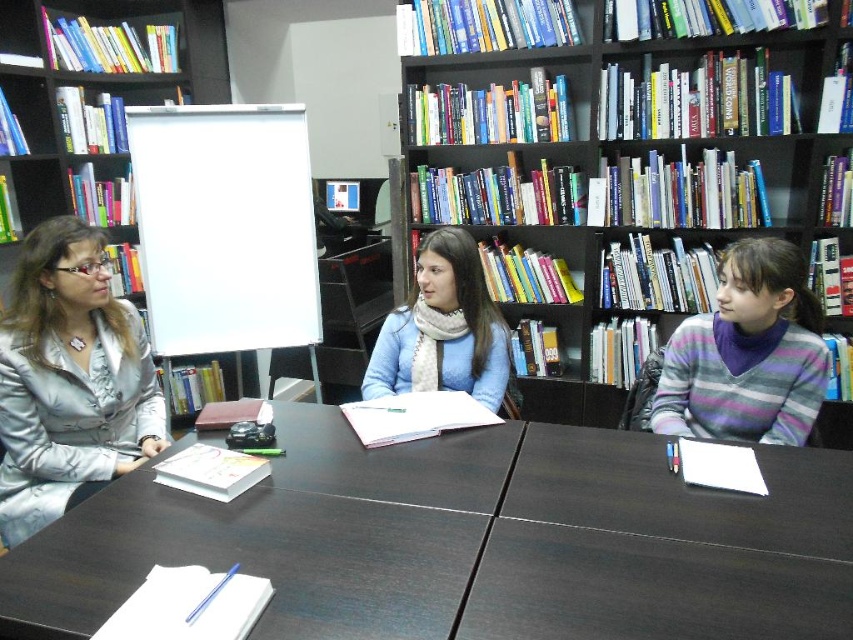
You are organizing items on the dark wood table at center and the blue scarf at center. Where should you place a new book to ensure it is visible from the front of the table?

Since the dark wood table at center is located below the blue scarf at center, placing the new book on the table would make it visible from the front as the scarf is above it.

You are organizing a study session in the library. You have a dark wood table at center and a striped sweater at right. Which object is taller?

The striped sweater at right is taller than the dark wood table at center.